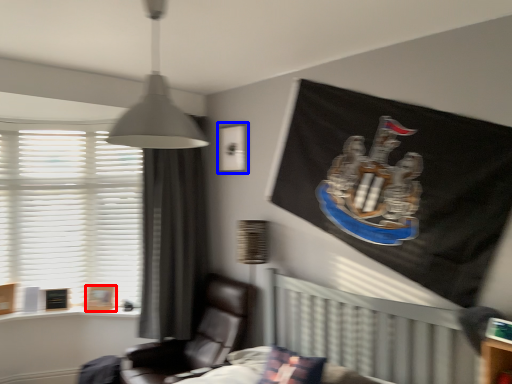
Question: Which point is closer to the camera, picture frame (highlighted by a red box) or picture frame (highlighted by a blue box)?

Choices:
 (A) picture frame
 (B) picture frame

Answer: (B)